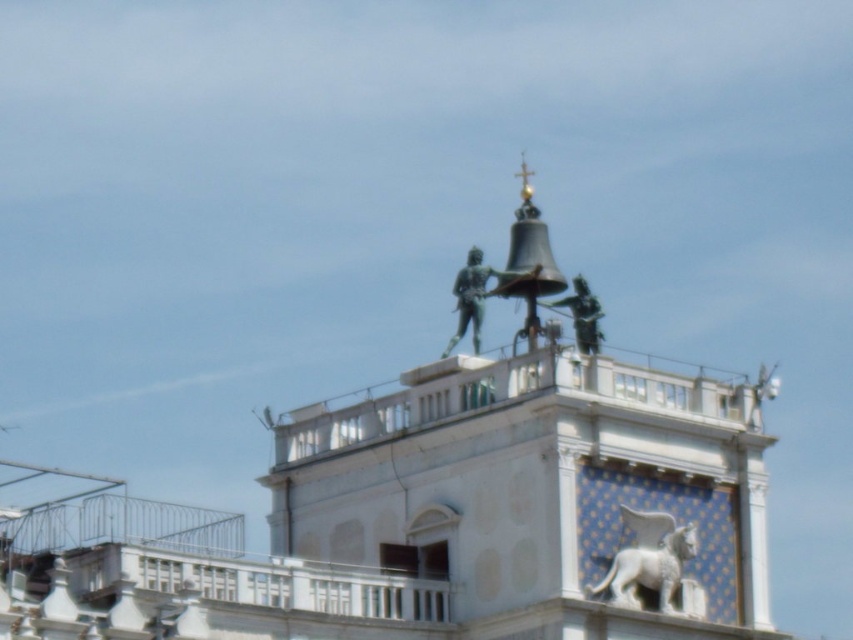
Question: Is green patina statue at center above green patina statue at upper center?

Choices:
 (A) yes
 (B) no

Answer: (A)

Question: Does white marble lion at center have a greater width compared to green patina statue at upper center?

Choices:
 (A) yes
 (B) no

Answer: (B)

Question: Which of these objects is positioned farthest from the green patina statue at center?

Choices:
 (A) white marble lion at center
 (B) green patina statue at upper center

Answer: (A)

Question: Which point is farther from the camera taking this photo?

Choices:
 (A) (682, 588)
 (B) (479, 326)
 (C) (550, 307)
 (D) (274, 449)

Answer: (D)

Question: Estimate the real-world distances between objects in this image. Which object is closer to the green patina statue at center?

Choices:
 (A) white marble lion at center
 (B) bronze statue at center
 (C) green patina statue at upper center

Answer: (C)

Question: Is white marble lion at center bigger than green patina statue at upper center?

Choices:
 (A) no
 (B) yes

Answer: (A)